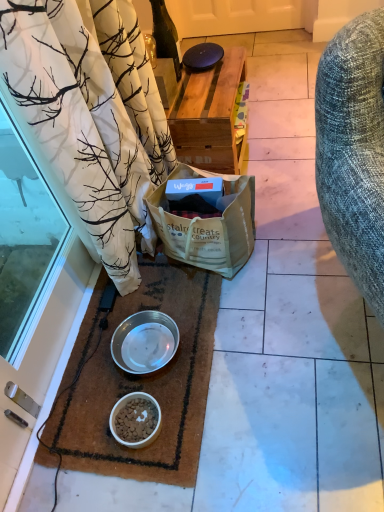
I want to click on unoccupied area in front of transparent glass door at lower left, so click(84, 418).